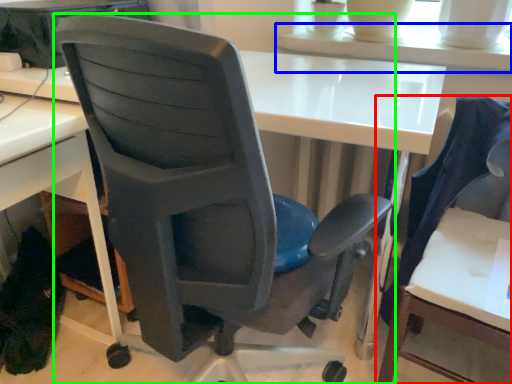
Question: Which is nearer to the chair (highlighted by a red box)? table (highlighted by a blue box) or chair (highlighted by a green box).

Choices:
 (A) table
 (B) chair

Answer: (A)